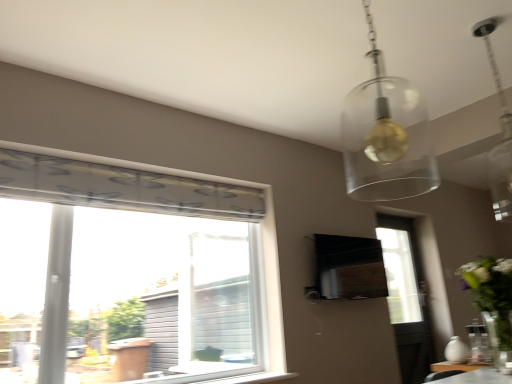
At what (x,y) coordinates should I click in order to perform the action: click on empty space that is ontop of clear glass pendant light at upper right (from a real-world perspective). Please return your answer as a coordinate pair (x, y). Looking at the image, I should click on 480,24.